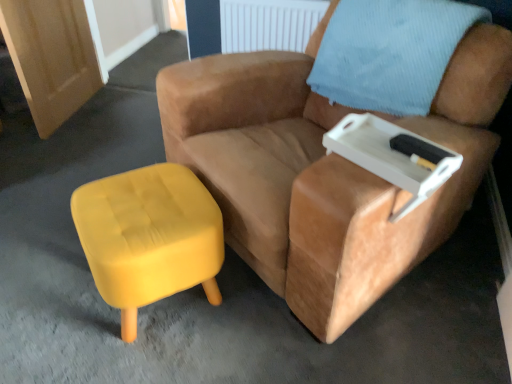
Where is `vacant area that is in front of yellow fabric stool at lower left`? The width and height of the screenshot is (512, 384). vacant area that is in front of yellow fabric stool at lower left is located at coordinates (145, 360).